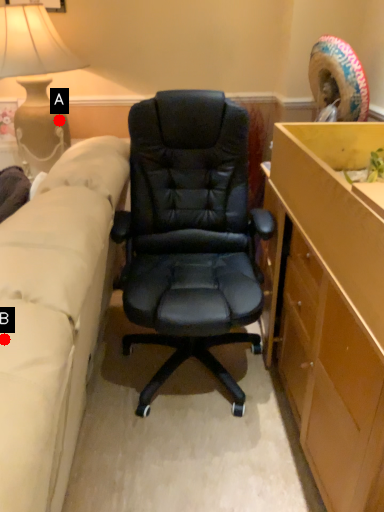
Question: Two points are circled on the image, labeled by A and B beside each circle. Which point appears closest to the camera in this image?

Choices:
 (A) A is closer
 (B) B is closer

Answer: (B)